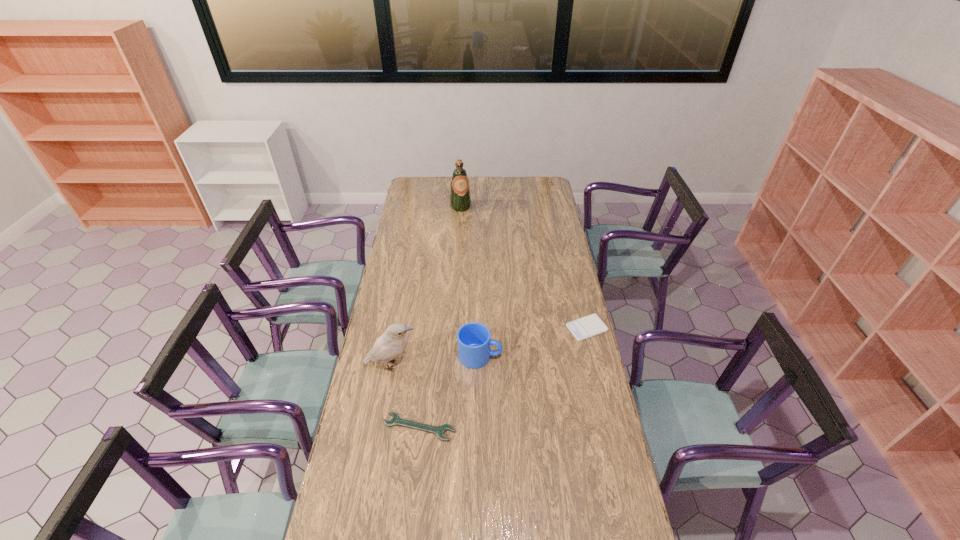
The width and height of the screenshot is (960, 540). Find the location of `free spot on the desktop that is between the nearest object and the rightmost object and is positioned at the beak of the fourth shortest object`. free spot on the desktop that is between the nearest object and the rightmost object and is positioned at the beak of the fourth shortest object is located at coordinates (530, 362).

Locate an element on the screen. The image size is (960, 540). free spot on the desktop that is between the nearest object and the fourth nearest object and is positioned on the front-facing side of the tallest object is located at coordinates point(525,364).

Identify the location of free spot on the desktop that is between the nearest object and the rightmost object and is positioned on the side of the third shortest object with the handle. The height and width of the screenshot is (540, 960). (530, 361).